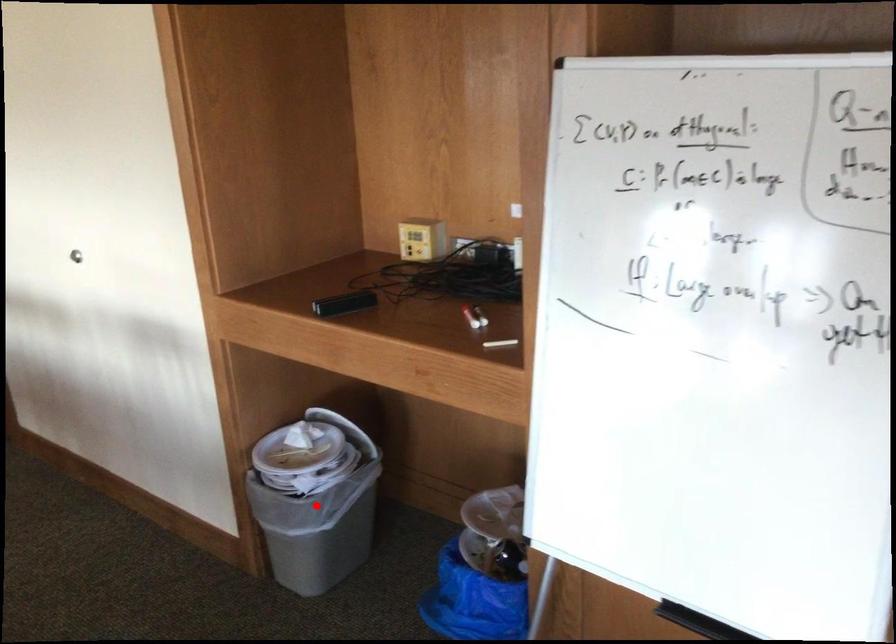
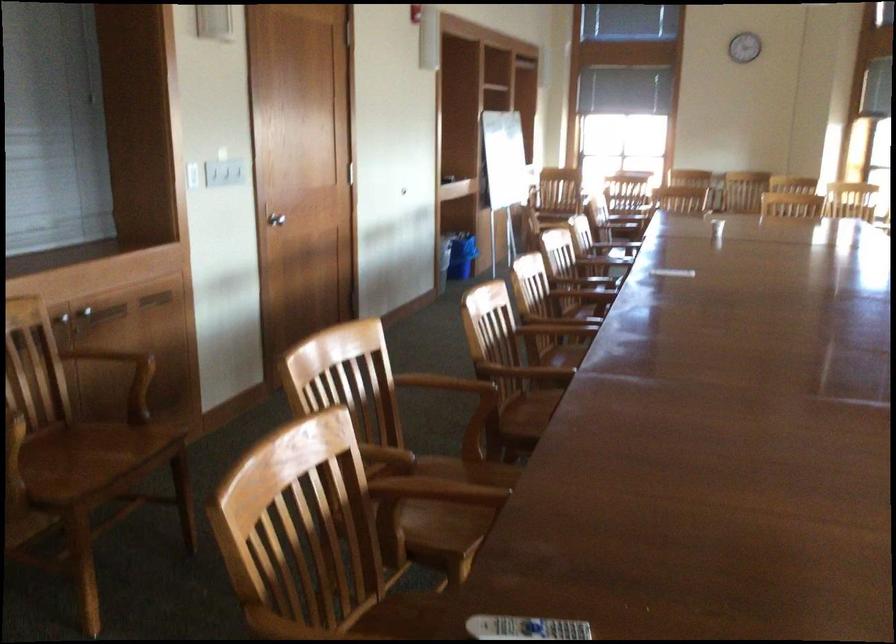
Question: I am providing you with two images of the same scene from different viewpoints. A red point is marked on the first image. At the location where the point appears in image 1, is it still visible in image 2?

Choices:
 (A) Yes
 (B) No

Answer: (B)